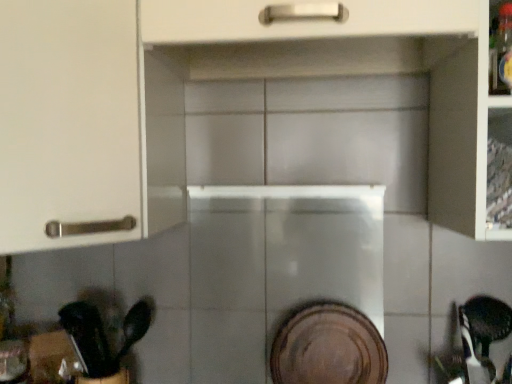
Question: From a real-world perspective, is white matte cabinet at upper left above or below brown matte platter at center?

Choices:
 (A) above
 (B) below

Answer: (A)

Question: Considering the positions of white matte cabinet at upper left and brown matte platter at center in the image, is white matte cabinet at upper left bigger or smaller than brown matte platter at center?

Choices:
 (A) big
 (B) small

Answer: (A)

Question: Which object is positioned farthest from the brown matte platter at center?

Choices:
 (A) black plastic spoon at lower left
 (B) white matte cabinet at upper left

Answer: (B)

Question: Considering the real-world distances, which object is closest to the white matte cabinet at upper left?

Choices:
 (A) black plastic spoon at lower left
 (B) brown matte platter at center

Answer: (A)